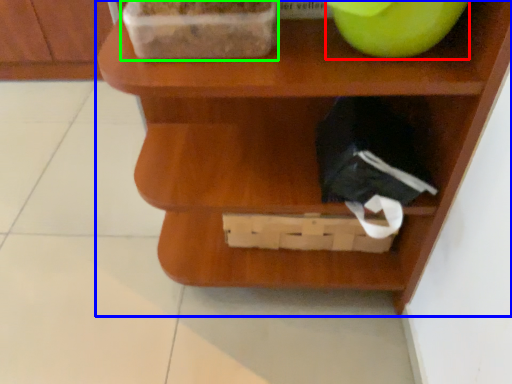
Question: Which object is positioned farthest from apple (highlighted by a red box)? Select from shelf (highlighted by a blue box) and wide (highlighted by a green box).

Choices:
 (A) shelf
 (B) wide

Answer: (A)